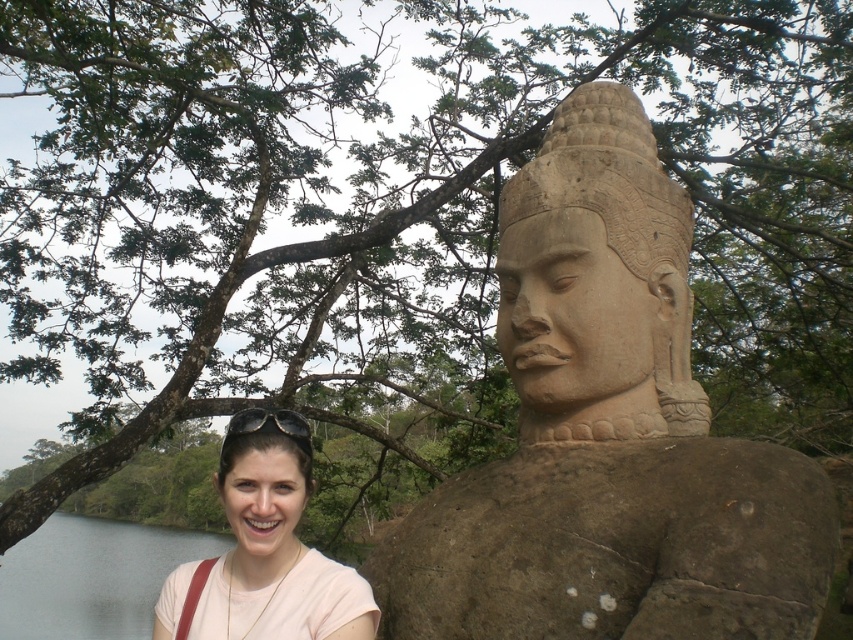
You are a photographer trying to frame a shot. You notice the matte pink shirt at lower left and the black matte sunglasses at lower left in your viewfinder. Which object is wider in the image?

The matte pink shirt at lower left is wider than the black matte sunglasses at lower left according to the description.

You are standing in front of the statue and want to take a photo. You notice two points marked on the statue. Which point, point (184, 628) or point (305, 442), is closer to you?

Point (184, 628) is closer to the camera than point (305, 442), so it is closer to you.

You are standing at the point closest to the statue. Which point, point (303, 477) or point (279, 419), is closer to the statue?

Point (279, 419) is closer to the statue because it is in front of point (303, 477).